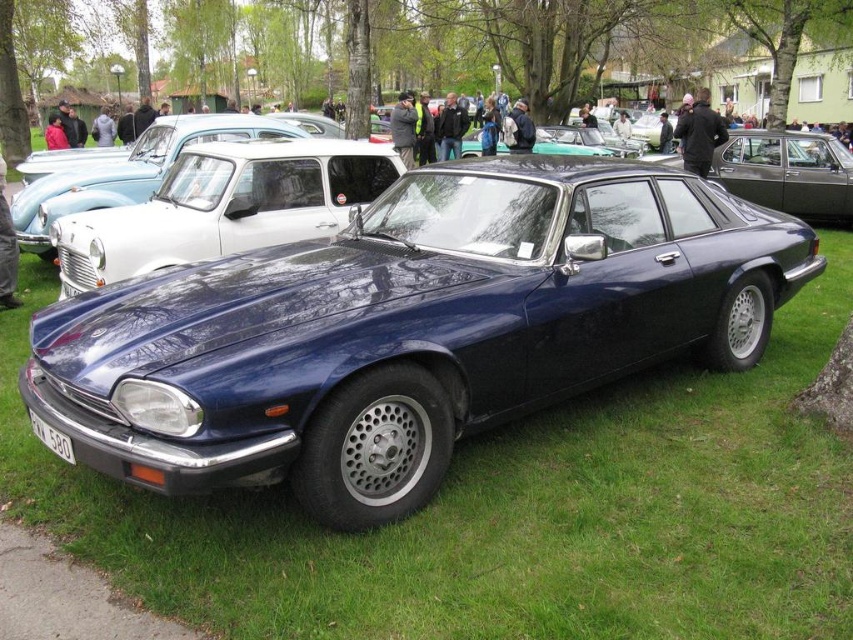
Does green textured tree at center have a greater width compared to glossy blue sedan at center?

Yes, green textured tree at center is wider than glossy blue sedan at center.

Is point (415, 1) farther from camera compared to point (218, 205)?

Yes.

The height and width of the screenshot is (640, 853). Identify the location of green textured tree at center. (485, 40).

Which is in front, point (119, 268) or point (33, 426)?

Point (33, 426) is more forward.

Does point (358, 154) come farther from viewer compared to point (68, 440)?

Yes, point (358, 154) is behind point (68, 440).

Who is more forward, (260, 216) or (65, 451)?

Positioned in front is point (65, 451).

Image resolution: width=853 pixels, height=640 pixels. I want to click on glossy blue sedan at center, so click(224, 205).

Is glossy blue car at center positioned at the back of white plastic license plate at lower left?

That is False.

The width and height of the screenshot is (853, 640). What do you see at coordinates (409, 328) in the screenshot?
I see `glossy blue car at center` at bounding box center [409, 328].

The image size is (853, 640). In order to click on glossy blue car at center in this screenshot , I will do `click(409, 328)`.